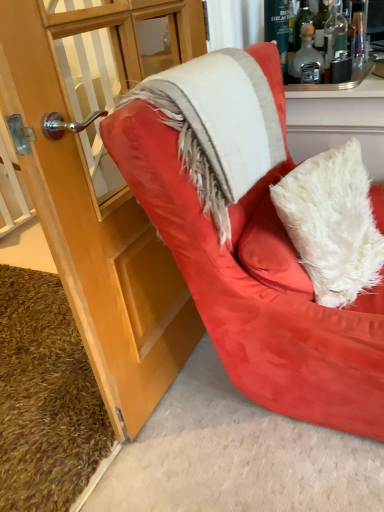
Question: From the image's perspective, is white fuzzy blanket at upper right located above or below translucent glass bottle at upper right, marked as the 1th bottle in a left-to-right arrangement?

Choices:
 (A) below
 (B) above

Answer: (A)

Question: In the image, is white fuzzy blanket at upper right on the left side or the right side of translucent glass bottle at upper right, marked as the 1th bottle in a left-to-right arrangement?

Choices:
 (A) left
 (B) right

Answer: (A)

Question: Estimate the real-world distances between objects in this image. Which object is farther from the white fluffy pillow at center?

Choices:
 (A) matte wood cabinet at left
 (B) translucent glass bottle at upper right, which is counted as the 2th bottle, starting from the right
 (C) brown shaggy carpet at lower left
 (D) white fuzzy blanket at upper right
 (E) translucent glass bottle at upper right, which is the 2th bottle in left-to-right order

Answer: (C)

Question: Which is nearer to the translucent glass bottle at upper right, which is the 2th bottle in left-to-right order?

Choices:
 (A) translucent glass bottle at upper right, marked as the 1th bottle in a left-to-right arrangement
 (B) suede red armchair at center
 (C) brown shaggy carpet at lower left
 (D) white fluffy pillow at center
 (E) white fuzzy blanket at upper right

Answer: (A)